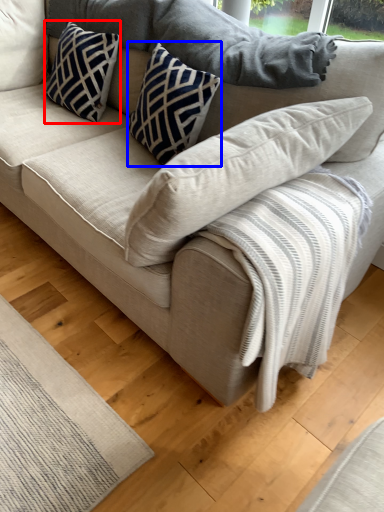
Question: Which object appears farthest to the camera in this image, pillow (highlighted by a red box) or pillow (highlighted by a blue box)?

Choices:
 (A) pillow
 (B) pillow

Answer: (A)